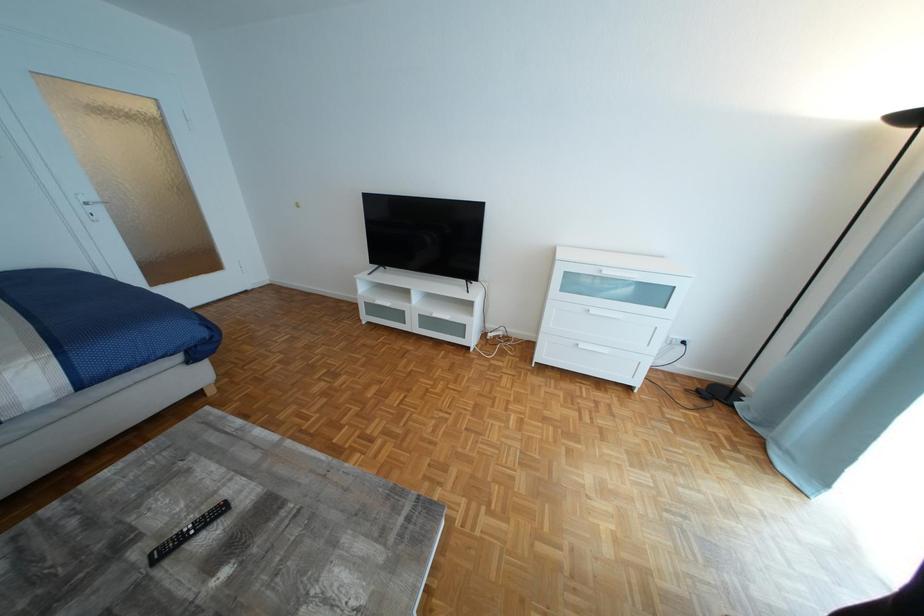
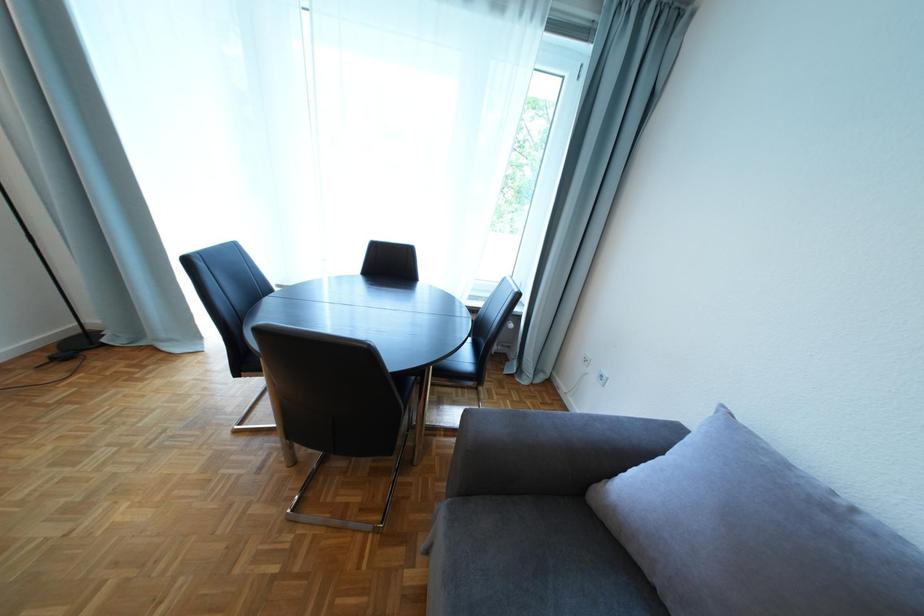
How did the camera likely rotate?

The rotation direction of the camera is right-down.